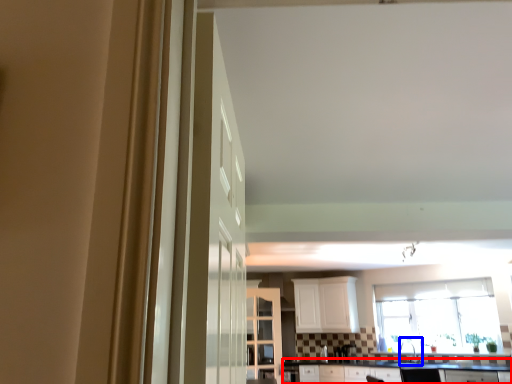
Question: Which of the following is the closest to the observer, countertop (highlighted by a red box) or sink (highlighted by a blue box)?

Choices:
 (A) countertop
 (B) sink

Answer: (A)